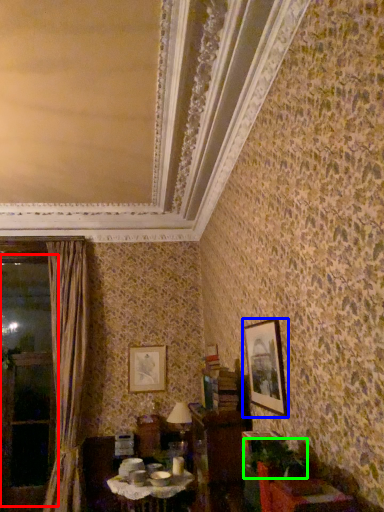
Question: Which object is positioned farthest from window (highlighted by a red box)? Select from picture frame (highlighted by a blue box) and plant (highlighted by a green box).

Choices:
 (A) picture frame
 (B) plant

Answer: (B)